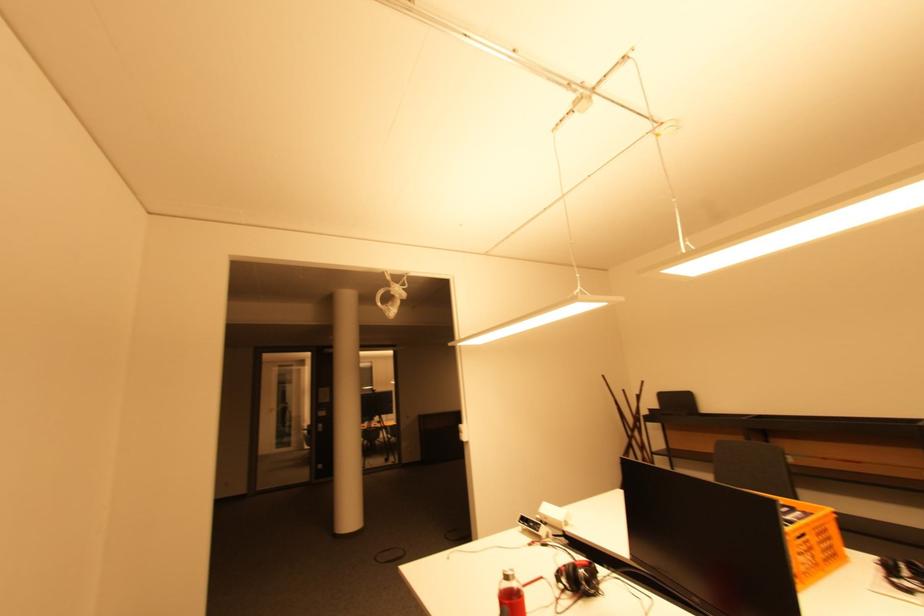
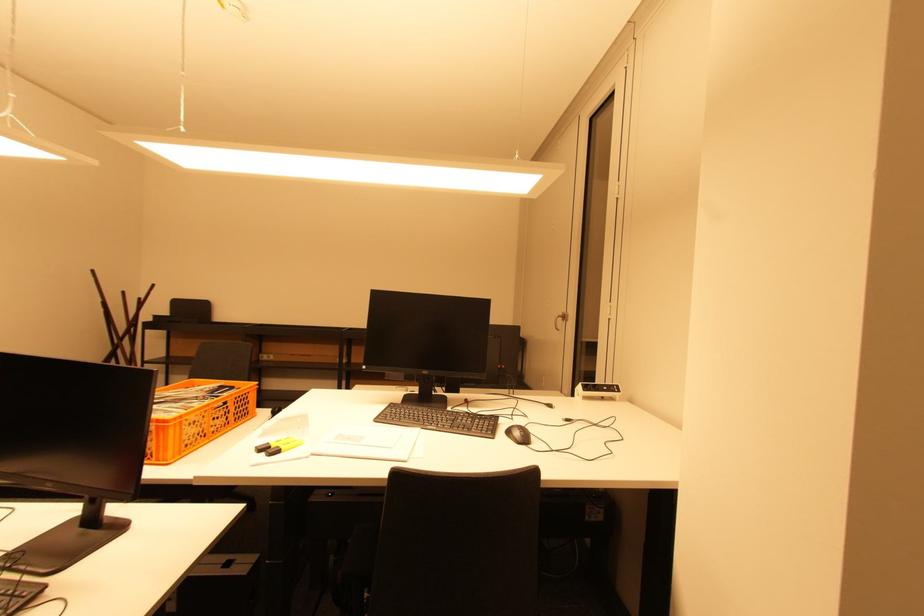
Question: The camera is either moving clockwise (left) or counter-clockwise (right) around the object. The first image is from the beginning of the video and the second image is from the end. Is the camera moving left or right when shooting the video?

Choices:
 (A) Left
 (B) Right

Answer: (A)